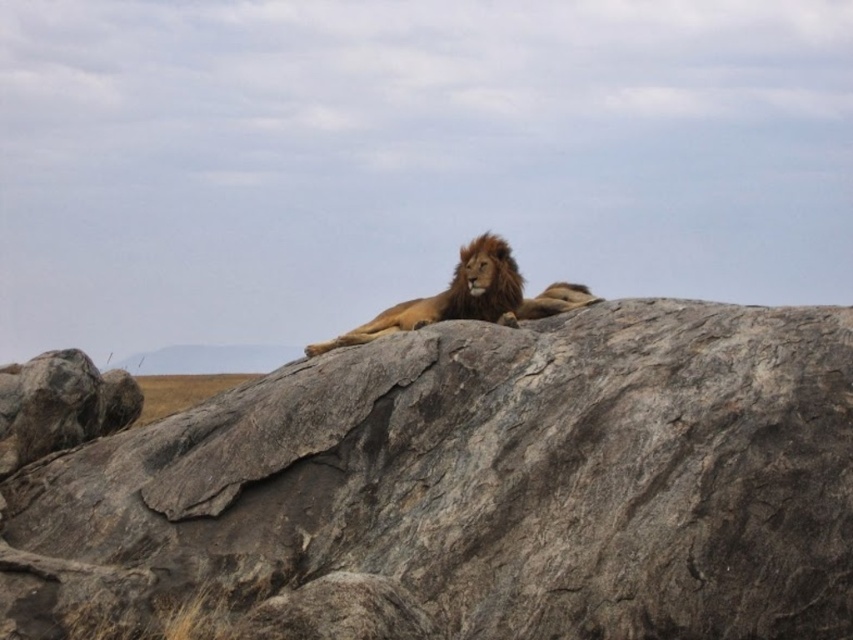
Can you confirm if gray rough rock at center is positioned above golden fur lion at center?

No.

Looking at this image, does gray rough rock at center have a greater width compared to golden fur lion at center?

Correct, the width of gray rough rock at center exceeds that of golden fur lion at center.

Does point (693, 602) come behind point (358, 339)?

No, it is not.

Find the location of a particular element. This screenshot has width=853, height=640. gray rough rock at center is located at coordinates (503, 477).